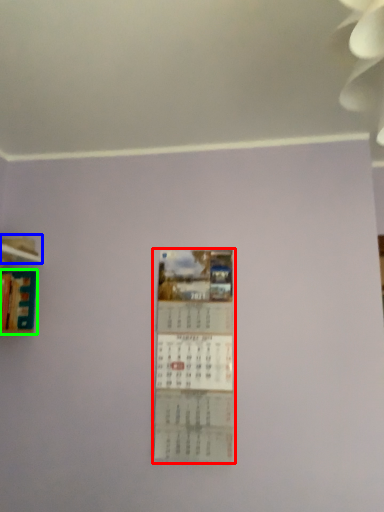
Question: Which is farther away from poster (highlighted by a red box)? shelf (highlighted by a blue box) or book (highlighted by a green box)?

Choices:
 (A) shelf
 (B) book

Answer: (A)